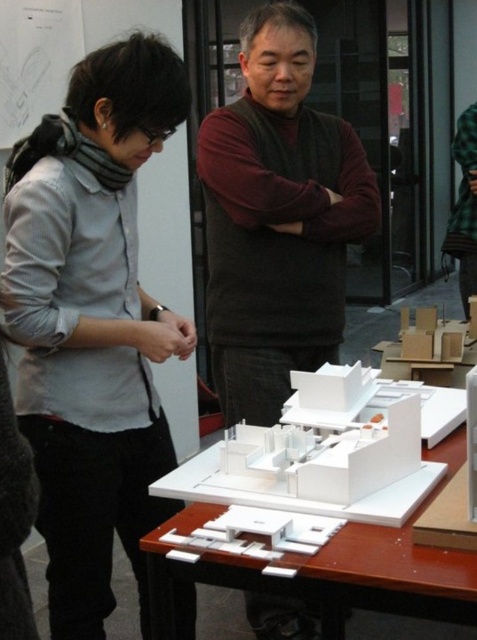
Question: Does matte gray shirt at left appear under white matte table at center?

Choices:
 (A) yes
 (B) no

Answer: (B)

Question: Which of the following is the closest to the observer?

Choices:
 (A) (472, 104)
 (B) (200, 520)
 (C) (60, 291)
 (D) (287, 627)

Answer: (B)

Question: Does matte brown sweater at center lie in front of green plaid shirt at center?

Choices:
 (A) no
 (B) yes

Answer: (B)

Question: Which is farther from the matte brown sweater at center?

Choices:
 (A) white matte table at center
 (B) matte gray shirt at left
 (C) green plaid shirt at center

Answer: (C)

Question: Which of the following is the closest to the observer?

Choices:
 (A) (217, 465)
 (B) (453, 145)

Answer: (A)

Question: Is matte brown sweater at center behind green plaid shirt at center?

Choices:
 (A) yes
 (B) no

Answer: (B)